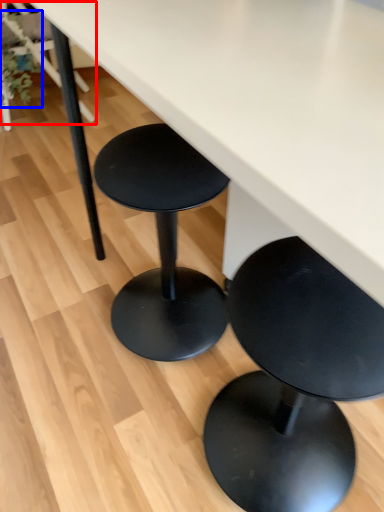
Question: Among these objects, which one is nearest to the camera, chair (highlighted by a red box) or plant (highlighted by a blue box)?

Choices:
 (A) chair
 (B) plant

Answer: (B)